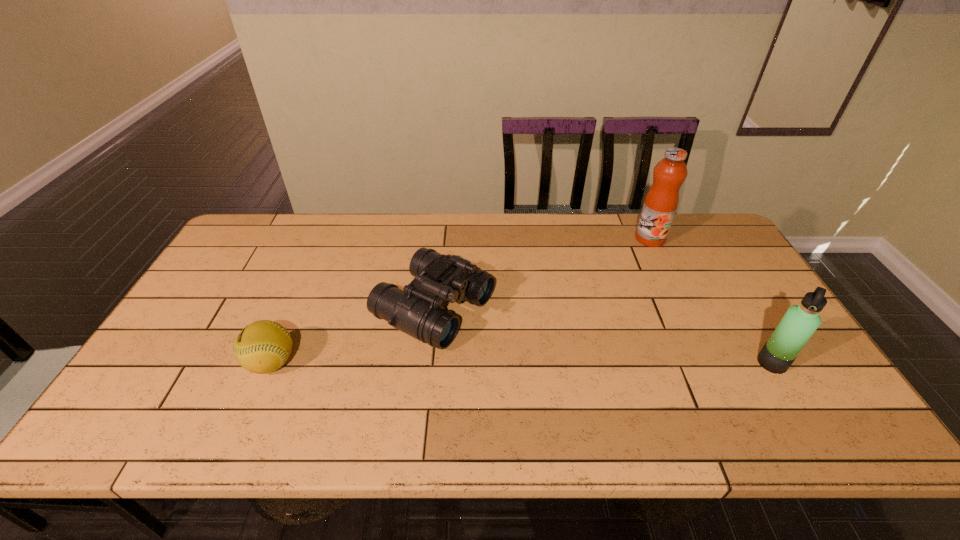
This screenshot has height=540, width=960. Identify the location of object that is at the right edge. (799, 323).

I want to click on object that is at the near right corner, so click(799, 323).

Image resolution: width=960 pixels, height=540 pixels. Identify the location of free space at the far edge of the desktop. (372, 234).

This screenshot has width=960, height=540. I want to click on free region at the near edge of the desktop, so click(342, 371).

In order to click on vacant space at the left edge of the desktop in this screenshot , I will do `click(239, 306)`.

The width and height of the screenshot is (960, 540). I want to click on vacant region at the right edge of the desktop, so pos(695,274).

Find the location of a particular element. The image size is (960, 540). free space at the far left corner is located at coordinates (274, 241).

The width and height of the screenshot is (960, 540). In the image, there is a desktop. In order to click on vacant space at the far right corner in this screenshot , I will do `click(690, 234)`.

At what (x,y) coordinates should I click in order to perform the action: click on vacant space at the near right corner. Please return your answer as a coordinate pair (x, y). The image size is (960, 540). Looking at the image, I should click on (783, 388).

This screenshot has width=960, height=540. Identify the location of vacant region between the third tallest object and the rightmost object. (603, 335).